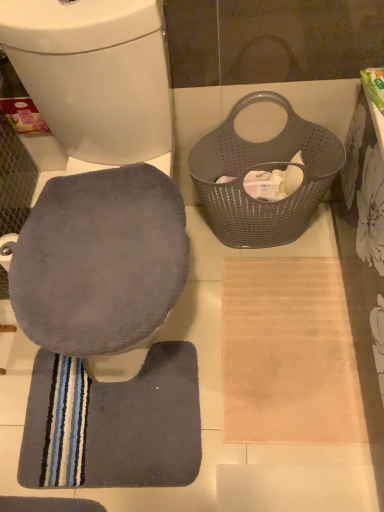
Locate an element on the screen. free spot above dark gray plush bath mat at lower left (from a real-world perspective) is located at coordinates (122, 401).